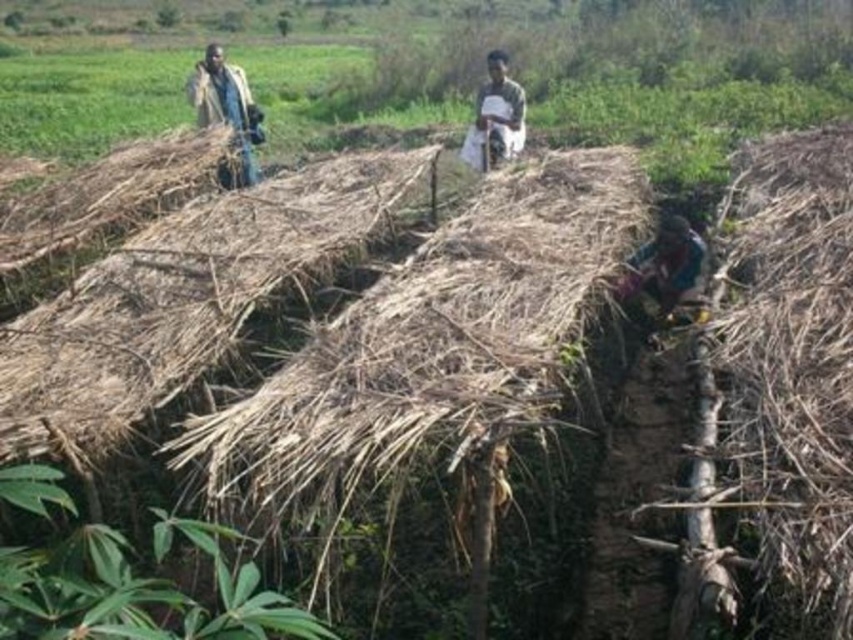
Can you confirm if dry straw at right is taller than light brown fabric at upper left?

Yes, dry straw at right is taller than light brown fabric at upper left.

Locate an element on the screen. dry straw at right is located at coordinates (792, 372).

Can you confirm if dry straw at right is positioned to the right of multicolored fabric at right?

Indeed, dry straw at right is positioned on the right side of multicolored fabric at right.

Which is below, dry straw at right or multicolored fabric at right?

Positioned lower is dry straw at right.

Between point (757, 522) and point (670, 268), which one is positioned in front?

Point (757, 522)

This screenshot has height=640, width=853. What are the coordinates of `dry straw at right` in the screenshot? It's located at (792, 372).

Locate an element on the screen. dry straw at right is located at coordinates (792, 372).

Who is lower down, dry straw at right or dark green fabric at center?

Positioned lower is dry straw at right.

Who is more distant from viewer, (776, 365) or (468, 145)?

Point (468, 145)

You are a GUI agent. You are given a task and a screenshot of the screen. Output one action in this format:
    pyautogui.click(x=<x>, y=<y>)
    Task: Click on the dry straw at right
    
    Given the screenshot: What is the action you would take?
    pyautogui.click(x=792, y=372)